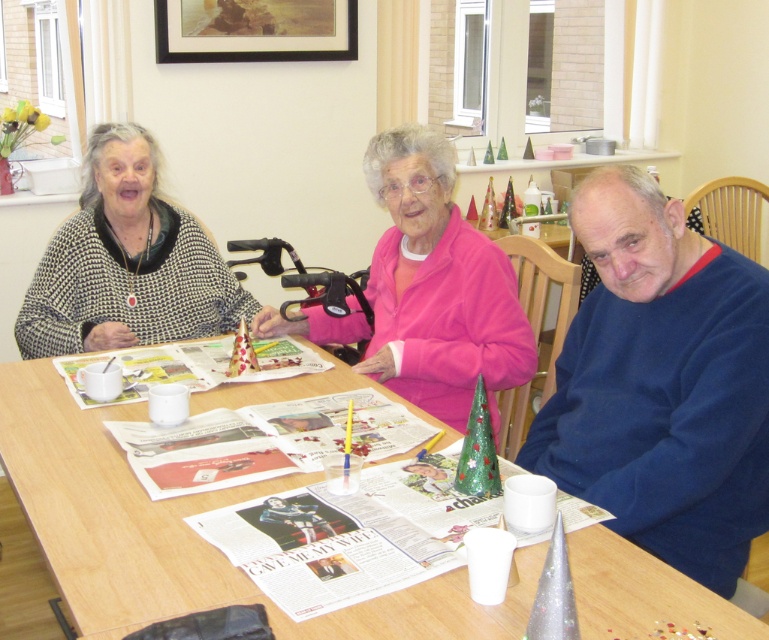
You are organizing a clothing donation drive and need to determine if the blue fleece sweater at right can fit inside the pink fleece jacket at center for transport. Based on their sizes, will it fit?

The blue fleece sweater at right is smaller than the pink fleece jacket at center, so it can fit inside the pink fleece jacket at center for transport.

You are standing at the position of the person on the left. You want to reach the point marked as point (751, 266). Is this point closer to you than the point marked as point (82, 424)?

Point (751, 266) is in front of point (82, 424), so yes, the point (751, 266) is closer to you than the point (82, 424).